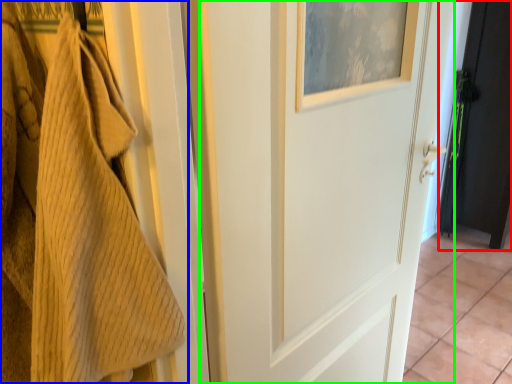
Question: Based on their relative distances, which object is farther from door (highlighted by a red box)? Choose from towel (highlighted by a blue box) and door (highlighted by a green box).

Choices:
 (A) towel
 (B) door

Answer: (A)